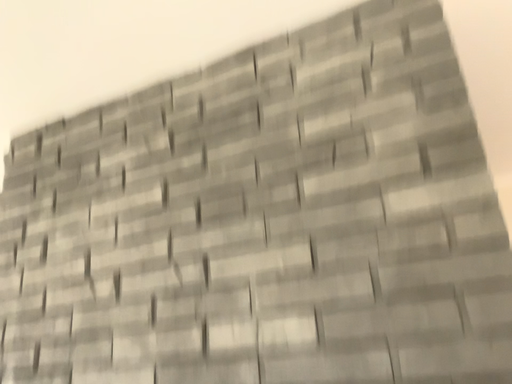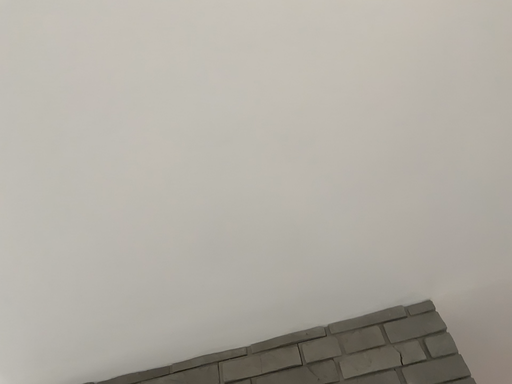
Question: Which way did the camera rotate in the video?

Choices:
 (A) rotated downward
 (B) rotated upward

Answer: (B)